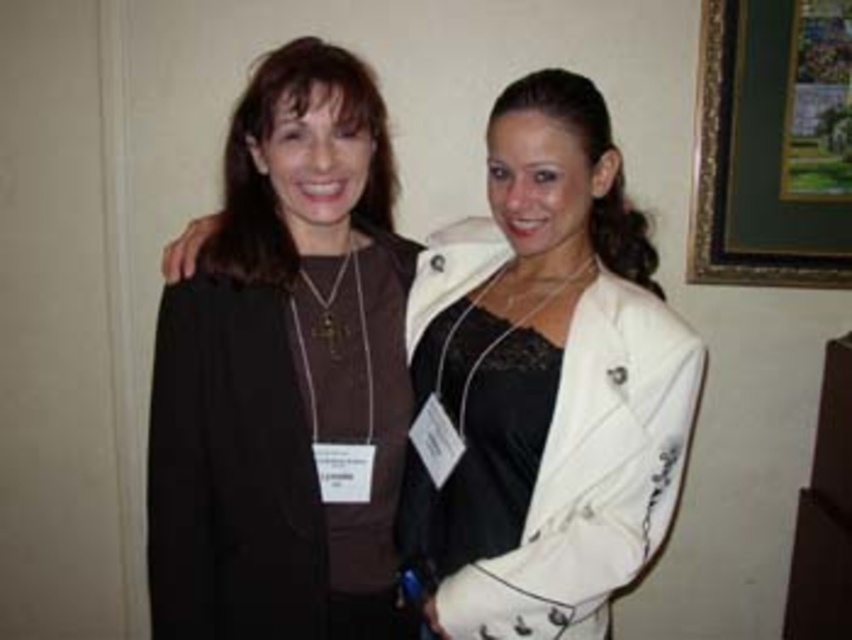
Question: Can you confirm if matte black jacket at left is positioned below black lace dress at center?

Choices:
 (A) no
 (B) yes

Answer: (A)

Question: Which point is closer to the camera taking this photo?

Choices:
 (A) (799, 60)
 (B) (266, 612)
 (C) (545, 362)

Answer: (C)

Question: Does gold-framed picture at upper right have a lesser width compared to black lace dress at center?

Choices:
 (A) yes
 (B) no

Answer: (B)

Question: Which point is closer to the camera?

Choices:
 (A) matte brown sweater at center
 (B) gold-framed picture at upper right

Answer: (A)

Question: Which point appears farthest from the camera in this image?

Choices:
 (A) (701, 84)
 (B) (452, 541)

Answer: (A)

Question: Does matte black jacket at left have a lesser width compared to black lace dress at center?

Choices:
 (A) yes
 (B) no

Answer: (B)